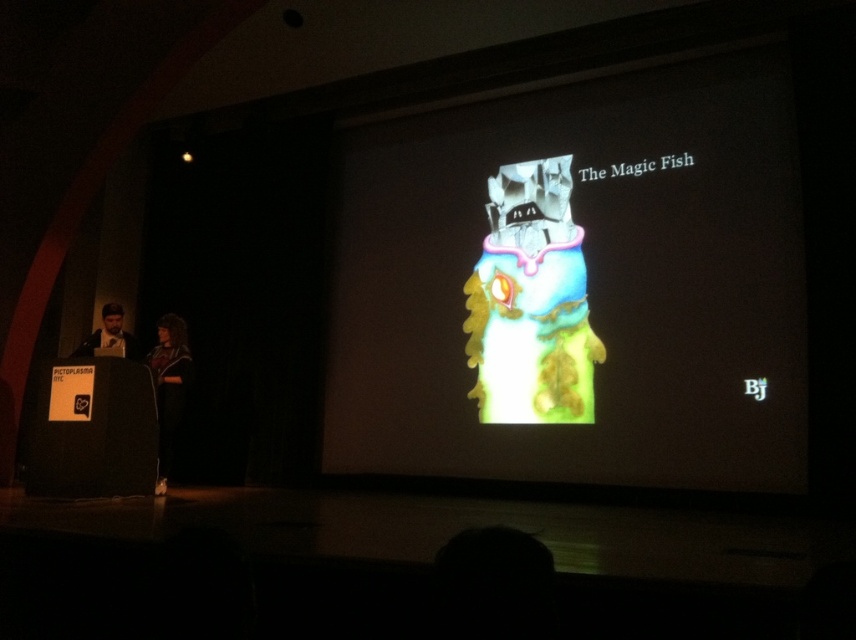
Consider the image. Between shiny metallic fish at center and matte black laptop at left, which one appears on the left side from the viewer's perspective?

From the viewer's perspective, matte black laptop at left appears more on the left side.

Does shiny metallic fish at center come behind matte black laptop at left?

Yes, it is.

Does point (536, 164) come closer to viewer compared to point (123, 339)?

No, it is behind (123, 339).

What are the coordinates of `shiny metallic fish at center` in the screenshot? It's located at (577, 285).

Can you confirm if black fabric at left is positioned below matte black laptop at left?

Correct, black fabric at left is located below matte black laptop at left.

From the picture: Can you confirm if black fabric at left is positioned above matte black laptop at left?

No.

Who is more distant from viewer, (182, 378) or (98, 330)?

The point (98, 330) is more distant.

You are a GUI agent. You are given a task and a screenshot of the screen. Output one action in this format:
    pyautogui.click(x=<x>, y=<y>)
    Task: Click on the black fabric at left
    This screenshot has height=640, width=856.
    Given the screenshot: What is the action you would take?
    pyautogui.click(x=168, y=387)

Does shiny metallic fish at center have a smaller size compared to black fabric at left?

Actually, shiny metallic fish at center might be larger than black fabric at left.

Who is more forward, (615,403) or (159,387)?

Point (159,387)

This screenshot has height=640, width=856. I want to click on shiny metallic fish at center, so click(x=577, y=285).